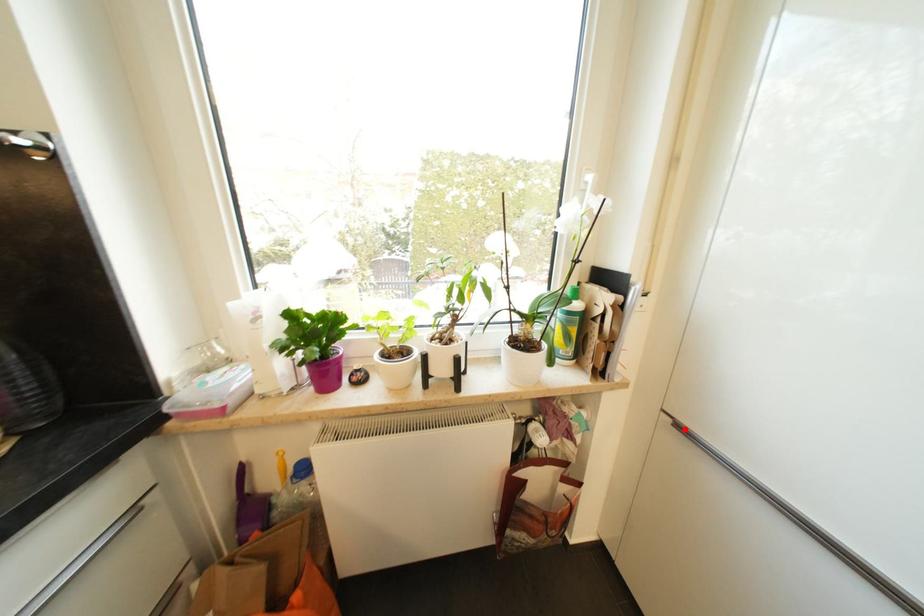
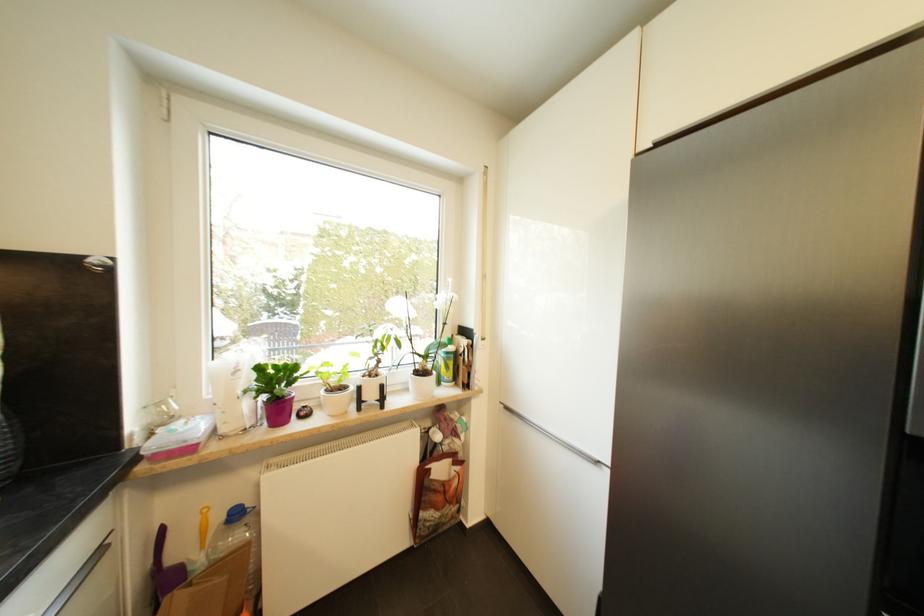
In the second image, find the point that corresponds to the highlighted location in the first image.

(512, 410)